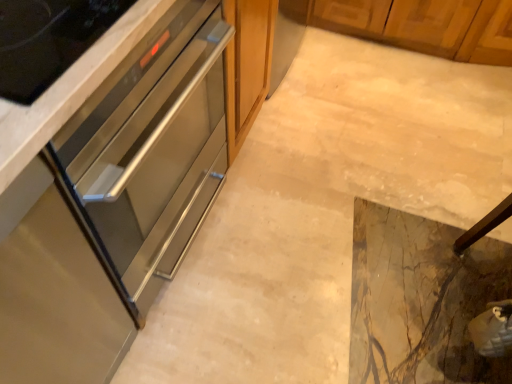
Question: Is stainless steel oven at center, the 1th cabinetry positioned from the top, smaller than stainless steel oven at left, which is the second cabinetry from bottom to top?

Choices:
 (A) yes
 (B) no

Answer: (A)

Question: Is stainless steel oven at center, the 1th cabinetry positioned from the top, closer to camera compared to stainless steel oven at left, which is the second cabinetry from bottom to top?

Choices:
 (A) no
 (B) yes

Answer: (A)

Question: Considering the relative positions of stainless steel oven at center, acting as the 3th cabinetry starting from the bottom, and stainless steel oven at left, which is the second cabinetry from bottom to top, in the image provided, is stainless steel oven at center, acting as the 3th cabinetry starting from the bottom, to the left of stainless steel oven at left, which is the second cabinetry from bottom to top, from the viewer's perspective?

Choices:
 (A) yes
 (B) no

Answer: (B)

Question: Does stainless steel oven at center, the 1th cabinetry positioned from the top, lie behind stainless steel oven at left, positioned as the 2th cabinetry in top-to-bottom order?

Choices:
 (A) no
 (B) yes

Answer: (B)

Question: Are stainless steel oven at center, the 1th cabinetry positioned from the top, and stainless steel oven at left, which is the second cabinetry from bottom to top, located far from each other?

Choices:
 (A) yes
 (B) no

Answer: (B)

Question: Is point (344, 235) positioned closer to the camera than point (135, 49)?

Choices:
 (A) farther
 (B) closer

Answer: (A)

Question: In terms of size, does marble tile floor at center appear bigger or smaller than stainless steel oven at left, which is the second cabinetry from bottom to top?

Choices:
 (A) small
 (B) big

Answer: (A)

Question: Considering the positions of marble tile floor at center and stainless steel oven at left, which is the second cabinetry from bottom to top, in the image, is marble tile floor at center taller or shorter than stainless steel oven at left, which is the second cabinetry from bottom to top,?

Choices:
 (A) tall
 (B) short

Answer: (B)

Question: Would you say marble tile floor at center is to the left or to the right of stainless steel oven at left, positioned as the 2th cabinetry in top-to-bottom order, in the picture?

Choices:
 (A) left
 (B) right

Answer: (B)

Question: Considering the positions of stainless steel oven at left, which is the second cabinetry from bottom to top, and marble tile floor at center in the image, is stainless steel oven at left, which is the second cabinetry from bottom to top, bigger or smaller than marble tile floor at center?

Choices:
 (A) small
 (B) big

Answer: (B)

Question: In terms of width, does stainless steel oven at left, which is the second cabinetry from bottom to top, look wider or thinner when compared to marble tile floor at center?

Choices:
 (A) thin
 (B) wide

Answer: (A)

Question: Based on their positions, is stainless steel oven at left, which is the second cabinetry from bottom to top, located to the left or right of marble tile floor at center?

Choices:
 (A) left
 (B) right

Answer: (A)

Question: From a real-world perspective, is stainless steel oven at left, which is the second cabinetry from bottom to top, physically located above or below marble tile floor at center?

Choices:
 (A) below
 (B) above

Answer: (B)

Question: From a real-world perspective, is stainless steel drawer at left, positioned as the first cabinetry in bottom-to-top order, positioned above or below stainless steel oven at center, acting as the 3th cabinetry starting from the bottom?

Choices:
 (A) below
 (B) above

Answer: (B)

Question: Is point (5, 355) closer or farther from the camera than point (40, 129)?

Choices:
 (A) closer
 (B) farther

Answer: (B)